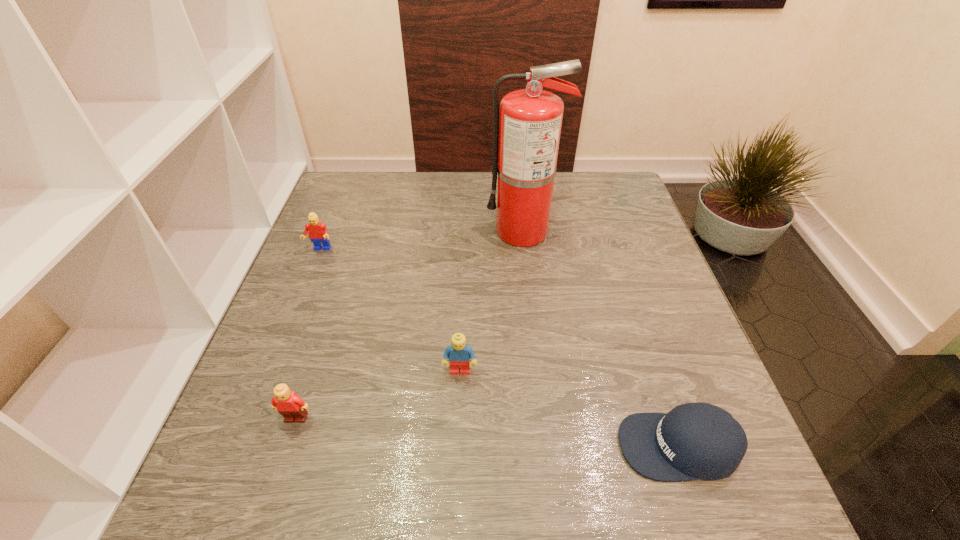
What are the coordinates of `object identified as the closest to the third object from right to left` in the screenshot? It's located at (292, 407).

Where is `Lego that is the second closest to the third farthest object`? Lego that is the second closest to the third farthest object is located at coordinates (317, 231).

Where is `Lego identified as the closest to the second Lego from left to right`? The height and width of the screenshot is (540, 960). Lego identified as the closest to the second Lego from left to right is located at coordinates (459, 353).

This screenshot has height=540, width=960. Identify the location of free point that satisfies the following two spatial constraints: 1. at the nozzle of the tallest object; 2. on the face of the rightmost Lego. (539, 371).

At what (x,y) coordinates should I click in order to perform the action: click on vacant region that satisfies the following two spatial constraints: 1. at the nozzle of the tallest object; 2. on the face of the rightmost Lego. Please return your answer as a coordinate pair (x, y). Image resolution: width=960 pixels, height=540 pixels. Looking at the image, I should click on (539, 371).

Where is `vacant region that satisfies the following two spatial constraints: 1. at the nozzle of the tallest object; 2. on the face of the second Lego from right to left`? vacant region that satisfies the following two spatial constraints: 1. at the nozzle of the tallest object; 2. on the face of the second Lego from right to left is located at coordinates (544, 418).